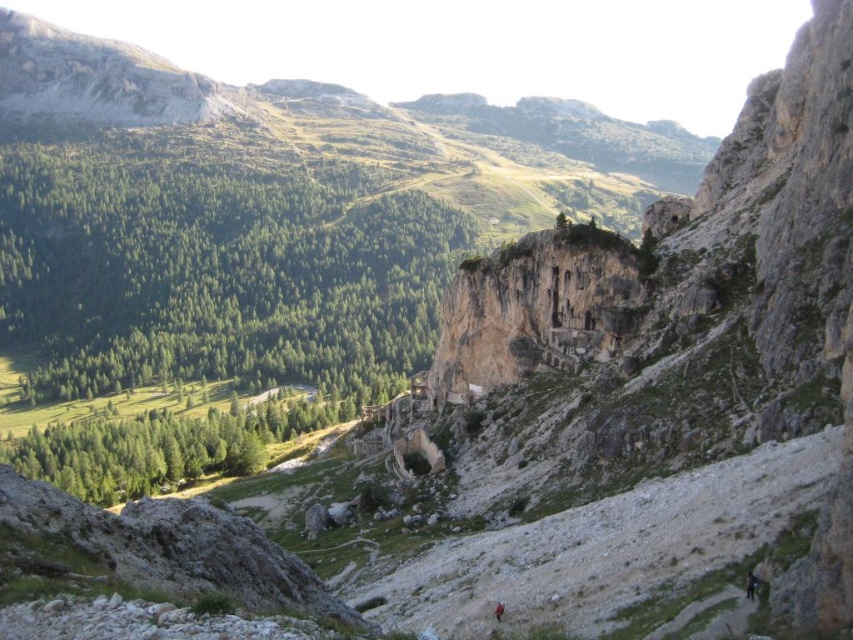
You are standing at the base of the mountain in the image and want to reach the point marked at coordinates point (x=492, y=257). If your hiking boots have a maximum comfortable walking distance of 100 meters, will you be able to comfortably reach that point?

The point (x=492, y=257) is 112.52 meters from the viewer, which exceeds the 100 meter limit of your hiking boots. Therefore, you will not be able to comfortably reach that point.

You are a hiker planning to take a photo of the brown rough rock face at center and the dark blue fabric person at lower right from a position near the dirt path. Can you see both objects in your camera frame at the same time?

The brown rough rock face at center is located above the dark blue fabric person at lower right, so yes, you can see both objects in your camera frame at the same time as long as the camera is positioned to include the upper and lower parts of the scene.

You are a hiker planning to take a photo of the brown rough rock face at center and the dark blue fabric person at lower right. Considering their sizes, which one should you focus on to ensure both are clearly visible in the photo?

The brown rough rock face at center is larger than the dark blue fabric person at lower right, so you should focus on the brown rough rock face at center to ensure both are clearly visible in the photo.